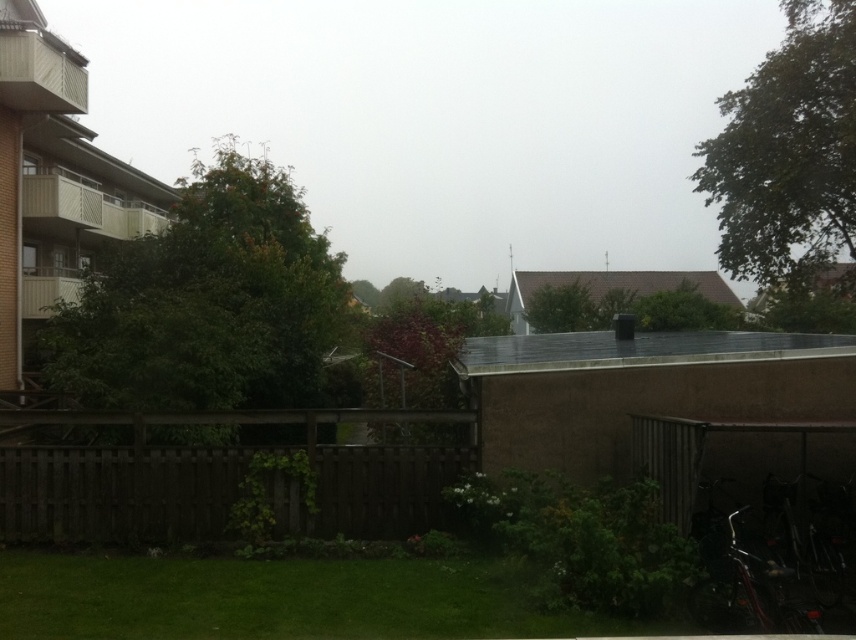
Question: Which of the following is the closest to the observer?

Choices:
 (A) (333, 132)
 (B) (205, 490)

Answer: (B)

Question: Observing the image, what is the correct spatial positioning of transparent fog at upper center in reference to brown wooden fence at lower left?

Choices:
 (A) below
 (B) above

Answer: (B)

Question: Can you confirm if transparent fog at upper center is wider than brown wooden fence at lower left?

Choices:
 (A) no
 (B) yes

Answer: (B)

Question: Is transparent fog at upper center closer to camera compared to brown wooden fence at lower left?

Choices:
 (A) yes
 (B) no

Answer: (B)

Question: Which object appears farthest from the camera in this image?

Choices:
 (A) transparent fog at upper center
 (B) brown wooden fence at lower left

Answer: (A)